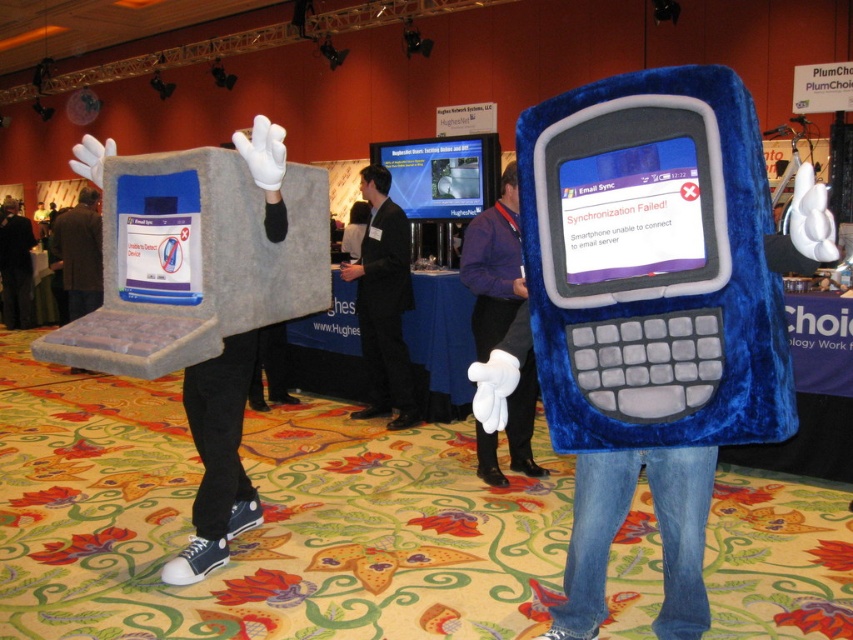
You are a GUI agent. You are given a task and a screenshot of the screen. Output one action in this format:
    pyautogui.click(x=<x>, y=<y>)
    Task: Click on the blue plush phone at center
    The height and width of the screenshot is (640, 853).
    Given the screenshot: What is the action you would take?
    pyautogui.click(x=492, y=266)

Describe the element at coordinates (492, 266) in the screenshot. Image resolution: width=853 pixels, height=640 pixels. I see `blue plush phone at center` at that location.

Which is in front, point (527, 403) or point (386, 240)?

Point (527, 403)

At what (x,y) coordinates should I click in order to perform the action: click on blue plush phone at center. Please return your answer as a coordinate pair (x, y). The width and height of the screenshot is (853, 640). Looking at the image, I should click on (492, 266).

Which is above, gray felt laptop at left or blue plush phone at center?

blue plush phone at center is above.

Is gray felt laptop at left to the left of blue plush phone at center from the viewer's perspective?

Yes, gray felt laptop at left is to the left of blue plush phone at center.

This screenshot has width=853, height=640. I want to click on gray felt laptop at left, so click(218, 458).

The image size is (853, 640). Find the location of `gray felt laptop at left`. gray felt laptop at left is located at coordinates (218, 458).

Is point (99, 182) behind point (363, 412)?

No, (99, 182) is closer to viewer.

Describe the element at coordinates (218, 458) in the screenshot. I see `gray felt laptop at left` at that location.

Does point (265, 122) lie behind point (386, 202)?

No, (265, 122) is in front of (386, 202).

You are a GUI agent. You are given a task and a screenshot of the screen. Output one action in this format:
    pyautogui.click(x=<x>, y=<y>)
    Task: Click on the gray felt laptop at left
    
    Given the screenshot: What is the action you would take?
    pyautogui.click(x=218, y=458)